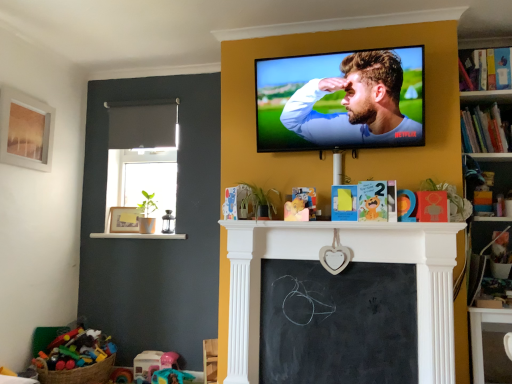
Question: Does matte wooden picture frame at upper left, the 1th picture frame from the left, have a lesser height compared to white glossy ledge at lower left?

Choices:
 (A) no
 (B) yes

Answer: (A)

Question: Is matte wooden picture frame at upper left, positioned as the 2th picture frame in bottom-to-top order, at the left side of white glossy ledge at lower left?

Choices:
 (A) yes
 (B) no

Answer: (A)

Question: Is the position of matte wooden picture frame at upper left, positioned as the 2th picture frame in bottom-to-top order, less distant than that of white glossy ledge at lower left?

Choices:
 (A) yes
 (B) no

Answer: (A)

Question: Can you confirm if matte wooden picture frame at upper left, the first picture frame viewed from the top, is taller than white glossy ledge at lower left?

Choices:
 (A) no
 (B) yes

Answer: (B)

Question: From a real-world perspective, is matte wooden picture frame at upper left, arranged as the 2th picture frame when viewed from the back, positioned over white glossy ledge at lower left based on gravity?

Choices:
 (A) yes
 (B) no

Answer: (A)

Question: From their relative heights in the image, would you say plastic pink toy at lower center, which appears as the 2th toy when viewed from the left, is taller or shorter than matte wooden picture frame at upper left, the 1th picture frame from the left?

Choices:
 (A) short
 (B) tall

Answer: (A)

Question: From a real-world perspective, is plastic pink toy at lower center, which appears as the 2th toy when viewed from the left, physically located above or below matte wooden picture frame at upper left, which is the first picture frame from front to back?

Choices:
 (A) above
 (B) below

Answer: (B)

Question: Considering the relative positions of plastic pink toy at lower center, which appears as the 2th toy when viewed from the left, and matte wooden picture frame at upper left, the first picture frame viewed from the top, in the image provided, is plastic pink toy at lower center, which appears as the 2th toy when viewed from the left, to the left or to the right of matte wooden picture frame at upper left, the first picture frame viewed from the top,?

Choices:
 (A) left
 (B) right

Answer: (B)

Question: From the image's perspective, is plastic pink toy at lower center, the first toy when ordered from right to left, above or below matte wooden picture frame at upper left, arranged as the 2th picture frame when viewed from the back?

Choices:
 (A) above
 (B) below

Answer: (B)

Question: Considering the positions of matte wooden picture frame at left, the second picture frame viewed from the top, and black fabric curtain at upper left in the image, is matte wooden picture frame at left, the second picture frame viewed from the top, bigger or smaller than black fabric curtain at upper left?

Choices:
 (A) small
 (B) big

Answer: (A)

Question: Based on their positions, is matte wooden picture frame at left, which is the 2th picture frame from left to right, located to the left or right of black fabric curtain at upper left?

Choices:
 (A) right
 (B) left

Answer: (B)

Question: Does point (120, 231) appear closer or farther from the camera than point (152, 117)?

Choices:
 (A) farther
 (B) closer

Answer: (A)

Question: From a real-world perspective, is matte wooden picture frame at left, which is the 2th picture frame from left to right, physically located above or below black fabric curtain at upper left?

Choices:
 (A) below
 (B) above

Answer: (A)

Question: Is point (476, 130) closer or farther from the camera than point (482, 67)?

Choices:
 (A) farther
 (B) closer

Answer: (A)

Question: Is hardcover book at upper right, the first book positioned from the bottom, taller or shorter than hardcover book at upper right, the second book ordered from the bottom?

Choices:
 (A) tall
 (B) short

Answer: (A)